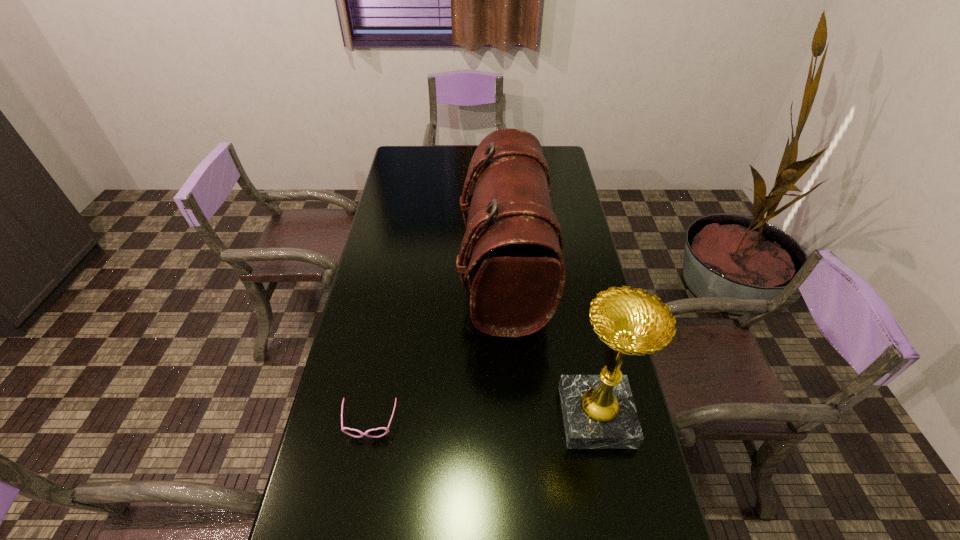
Locate which object ranks second in proximity to the satchel. Please provide its 2D coordinates. Your answer should be formatted as a tuple, i.e. [(x, y)], where the tuple contains the x and y coordinates of a point satisfying the conditions above.

[(379, 432)]

Image resolution: width=960 pixels, height=540 pixels. I want to click on the closest object relative to the satchel, so click(x=599, y=412).

Locate an element on the screen. The image size is (960, 540). free spot that satisfies the following two spatial constraints: 1. on the front-facing side of the satchel; 2. on the front-facing side of the leftmost object is located at coordinates coord(512,423).

You are a GUI agent. You are given a task and a screenshot of the screen. Output one action in this format:
    pyautogui.click(x=<x>, y=<y>)
    Task: Click on the vacant region that satisfies the following two spatial constraints: 1. on the front-facing side of the award; 2. on the front-facing side of the sunglasses
    The height and width of the screenshot is (540, 960).
    Given the screenshot: What is the action you would take?
    pyautogui.click(x=598, y=423)